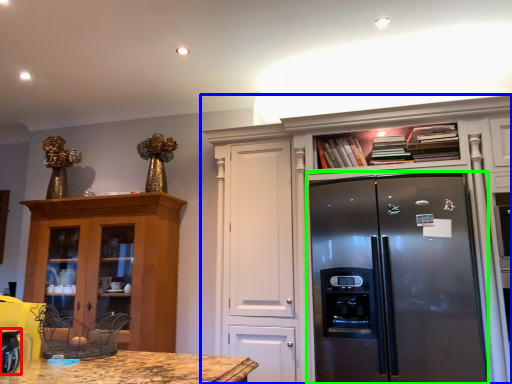
Question: Which object is the closest to the appliance (highlighted by a red box)? Choose among these: cabinetry (highlighted by a blue box) or refrigerator (highlighted by a green box).

Choices:
 (A) cabinetry
 (B) refrigerator

Answer: (B)